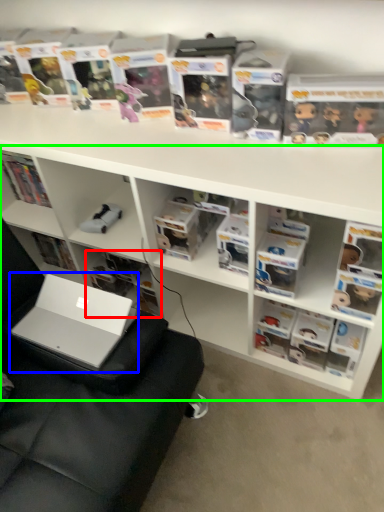
Question: Estimate the real-world distances between objects in this image. Which object is farther from book (highlighted by a red box), laptop (highlighted by a blue box) or bookshelf (highlighted by a green box)?

Choices:
 (A) laptop
 (B) bookshelf

Answer: (A)